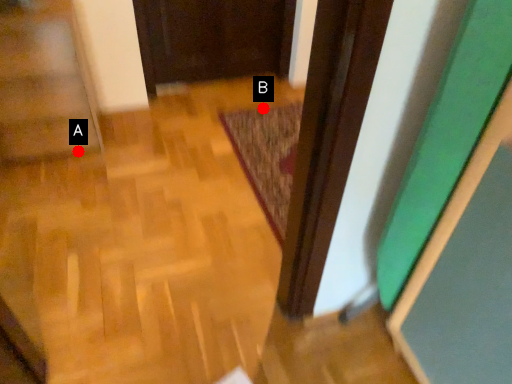
Question: Two points are circled on the image, labeled by A and B beside each circle. Which point is closer to the camera?

Choices:
 (A) A is closer
 (B) B is closer

Answer: (A)